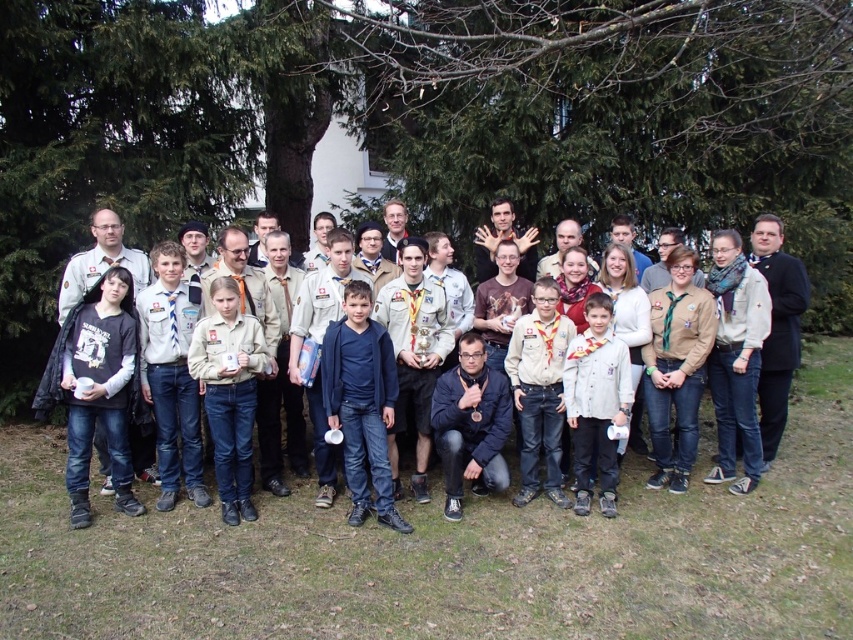
Between khaki uniform at center and matte khaki uniform at center, which one is positioned higher?

Positioned higher is khaki uniform at center.

Is point (184, 456) less distant than point (244, 497)?

That is False.

Who is more forward, (x=225, y=230) or (x=235, y=422)?

Point (x=235, y=422)

I want to click on khaki uniform at center, so click(x=109, y=237).

Does matte khaki uniform at center come in front of denim jeans at center?

Yes.

Which is in front, point (241, 502) or point (537, 332)?

Point (241, 502) is more forward.

What do you see at coordinates (229, 392) in the screenshot? I see `matte khaki uniform at center` at bounding box center [229, 392].

At what (x,y) coordinates should I click in order to perform the action: click on matte khaki uniform at center. Please return your answer as a coordinate pair (x, y). The image size is (853, 640). Looking at the image, I should click on (229, 392).

Is light brown uniform at center behind denim jeans at center?

No, light brown uniform at center is closer to the viewer.

Between light brown uniform at center and denim jeans at center, which one has less height?

Standing shorter between the two is light brown uniform at center.

Is point (602, 422) more distant than point (527, 406)?

No, it is in front of (527, 406).

Where is `light brown uniform at center`? The height and width of the screenshot is (640, 853). light brown uniform at center is located at coordinates [x=596, y=403].